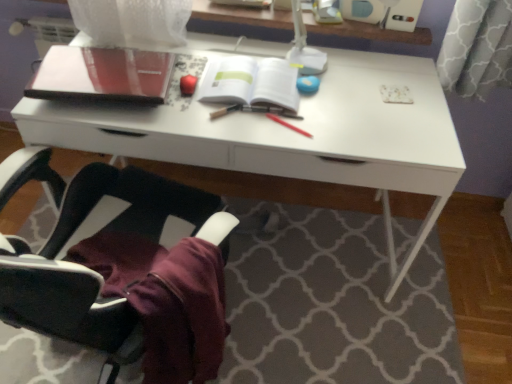
This screenshot has height=384, width=512. Identify the location of free space between white paper at center and red matte pen at center, positioned as the 3th stationery in left-to-right order. (281, 119).